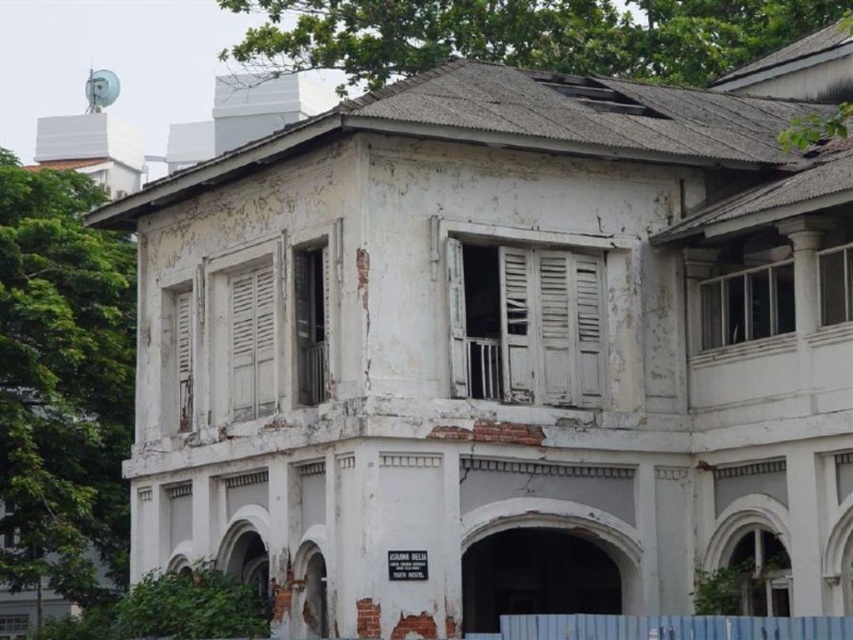
You are standing in front of the old building and notice two points marked on its facade. The first point is at coordinate (556, 310) and the second at (254, 396). From your perspective, which point is closer to you?

Point (556, 310) is in front of point (254, 396), so it is closer to you.

You are a painter assessing the building for restoration. You need to know which shutter requires more paint because of its larger size. Which one should you prioritize between the white matte shutters at center and the white wooden shutter at left?

The white matte shutters at center should be prioritized as they are wider than the white wooden shutter at left, requiring more paint due to their larger size.